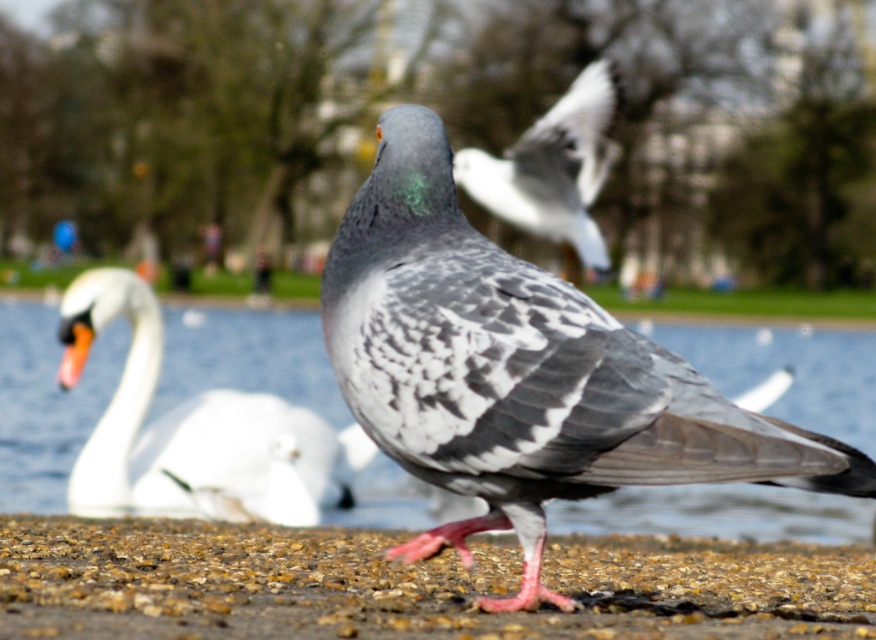
Question: Among these objects, which one is farthest from the camera?

Choices:
 (A) speckled feather pigeon at center
 (B) white feathered bird at upper center
 (C) clear water at center

Answer: (B)

Question: Based on their relative distances, which object is farther from the speckled feather pigeon at center?

Choices:
 (A) clear water at center
 (B) white glossy swan at left
 (C) white feathered bird at upper center

Answer: (C)

Question: Does speckled feather pigeon at center have a lesser width compared to clear water at center?

Choices:
 (A) yes
 (B) no

Answer: (A)

Question: Is brown gravel at center above white feathered bird at upper center?

Choices:
 (A) no
 (B) yes

Answer: (A)

Question: Is speckled feather pigeon at center further to camera compared to white feathered bird at upper center?

Choices:
 (A) no
 (B) yes

Answer: (A)

Question: Based on their relative distances, which object is farther from the clear water at center?

Choices:
 (A) speckled feather pigeon at center
 (B) white glossy swan at left

Answer: (B)